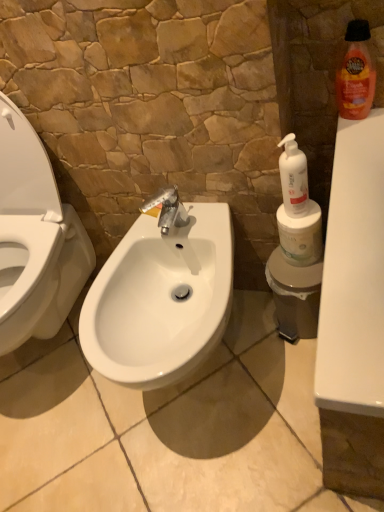
Where is `vacant area that lies in front of white glossy bidet at center`? This screenshot has width=384, height=512. vacant area that lies in front of white glossy bidet at center is located at coordinates (77, 451).